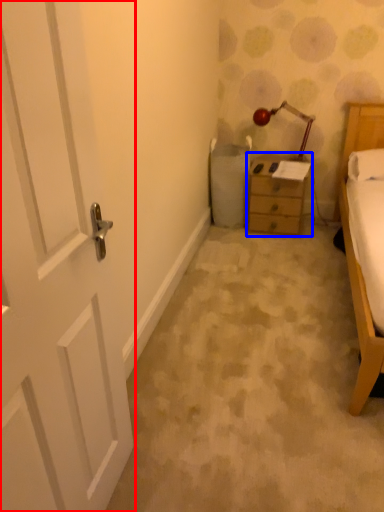
Question: Which of the following is the closest to the observer, door (highlighted by a red box) or nightstand (highlighted by a blue box)?

Choices:
 (A) door
 (B) nightstand

Answer: (A)